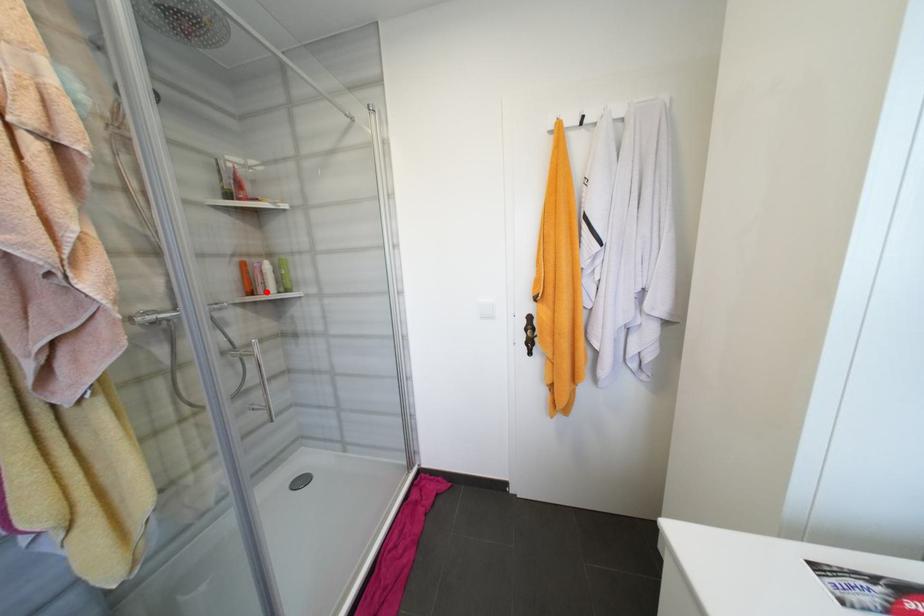
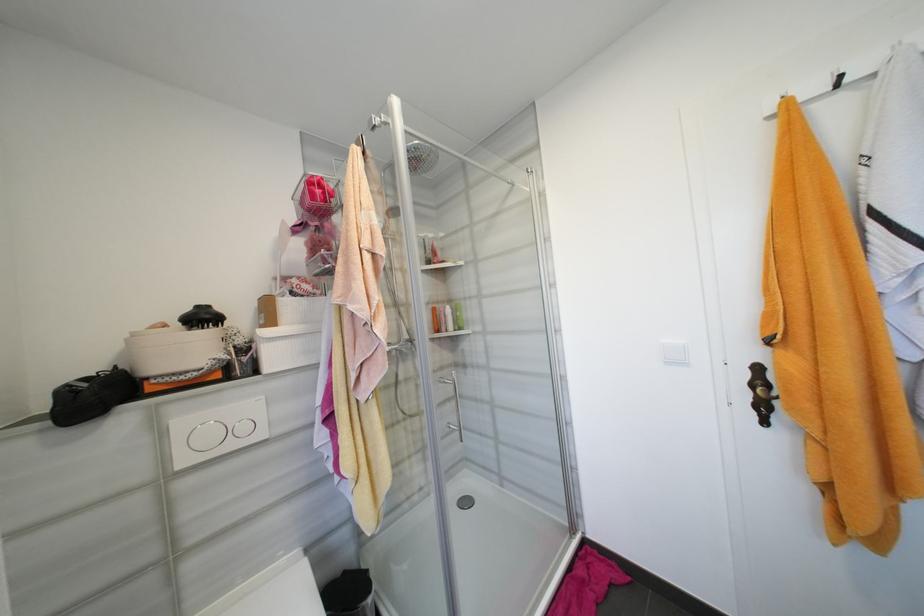
Find the pixel in the second image that matches the highlighted location in the first image.

(450, 330)